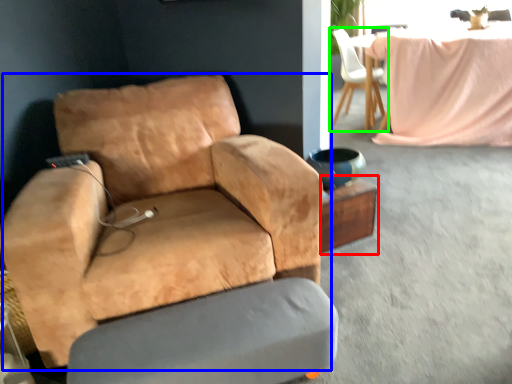
Question: Which object is positioned closest to side table (highlighted by a red box)? Select from chair (highlighted by a blue box) and chair (highlighted by a green box).

Choices:
 (A) chair
 (B) chair

Answer: (A)